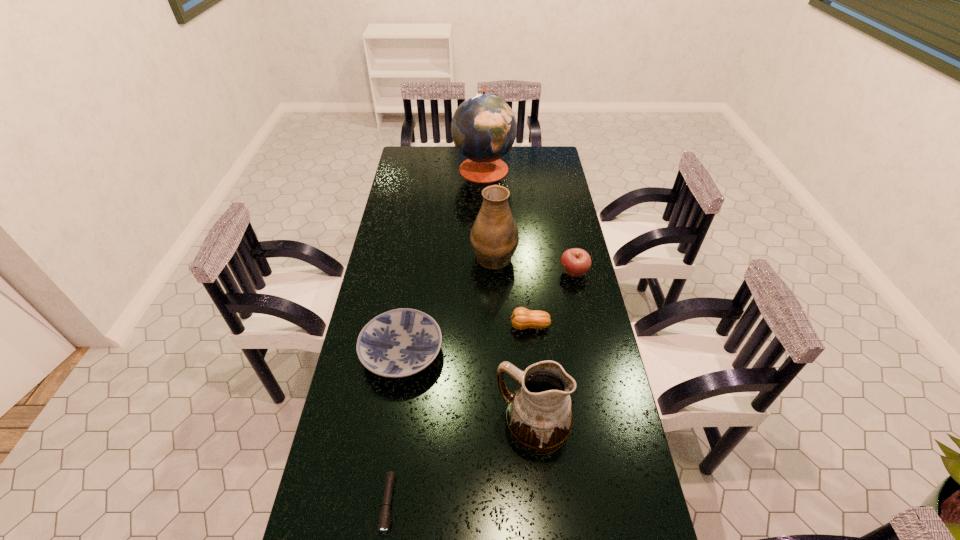
Find the location of a particular element. The image size is (960, 540). apple positioned at the right edge is located at coordinates [x=576, y=262].

Where is `vacant space at the far edge of the desktop`? The height and width of the screenshot is (540, 960). vacant space at the far edge of the desktop is located at coordinates (463, 161).

In the image, there is a desktop. Find the location of `vacant space at the left edge`. vacant space at the left edge is located at coordinates (311, 534).

This screenshot has height=540, width=960. Find the location of `free space at the right edge`. free space at the right edge is located at coordinates (539, 227).

Identify the location of vacant region at the far left corner of the desktop. Image resolution: width=960 pixels, height=540 pixels. (422, 156).

At what (x,y) coordinates should I click in order to perform the action: click on vacant space in between the nearer pitcher and the farther pitcher. Please return your answer as a coordinate pair (x, y). The image size is (960, 540). Looking at the image, I should click on (514, 341).

The width and height of the screenshot is (960, 540). In order to click on vacant space in between the gourd and the plate in this screenshot , I will do `click(465, 339)`.

Locate an element on the screen. free spot between the tallest object and the plate is located at coordinates (443, 260).

Where is `empty location between the rightmost object and the farther pitcher`? Image resolution: width=960 pixels, height=540 pixels. empty location between the rightmost object and the farther pitcher is located at coordinates (534, 264).

Locate an element on the screen. vacant space in between the gourd and the plate is located at coordinates (465, 339).